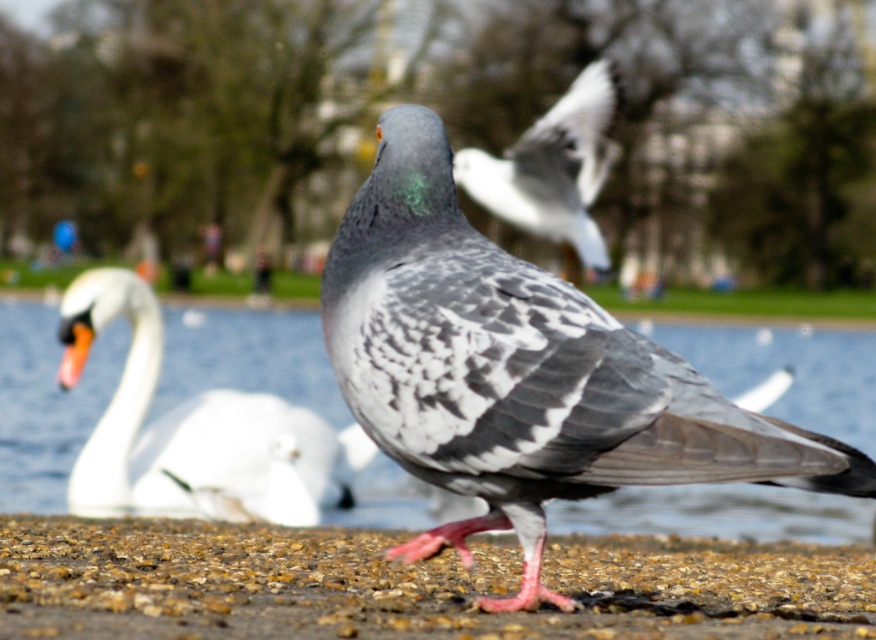
You are a photographer trying to capture the white glossy swan at left in the background of your shot. The clear water at center is blocking your view. Can you adjust your position to see the swan without moving the water?

The clear water at center is located above the white glossy swan at left, so if you lower your camera angle or move your position downward, you can see the swan below the water.

Consider the image. You are a photographer trying to capture the white glossy swan at left and the brown gravel at center in the same frame. Based on their positions, which object should you focus on to ensure both are in focus?

The brown gravel at center is below the white glossy swan at left, so focusing on the white glossy swan at left would ensure both are in focus since it is closer to the camera than the gravel.

You are a photographer aiming to capture the clear water at center and the white glossy swan at left in a single shot. Based on their positions, which object will appear larger in your photo?

The clear water at center will appear larger in the photo because it is closer to the viewer than the white glossy swan at left.